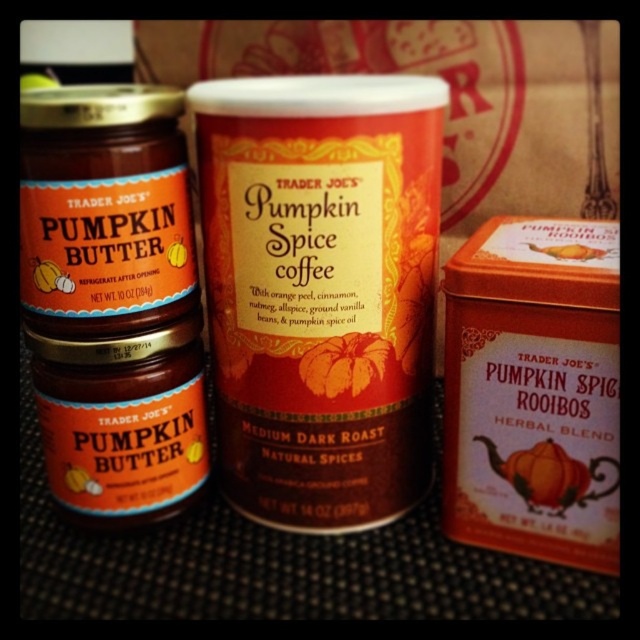
Does point (499, 460) come farther from viewer compared to point (582, 244)?

Yes, point (499, 460) is behind point (582, 244).

Locate an element on the screen. The width and height of the screenshot is (640, 640). matte orange tin at center right is located at coordinates (552, 476).